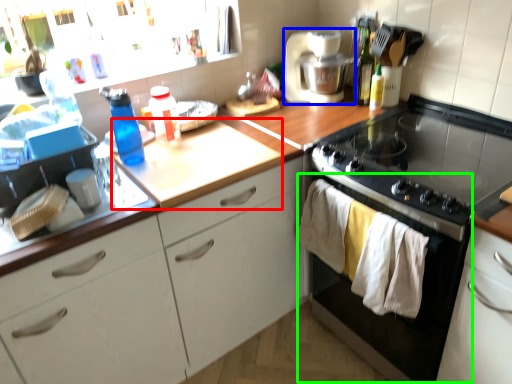
Question: Which object is positioned closest to counter top (highlighted by a red box)? Select from kitchen appliance (highlighted by a blue box) and oven (highlighted by a green box).

Choices:
 (A) kitchen appliance
 (B) oven

Answer: (B)